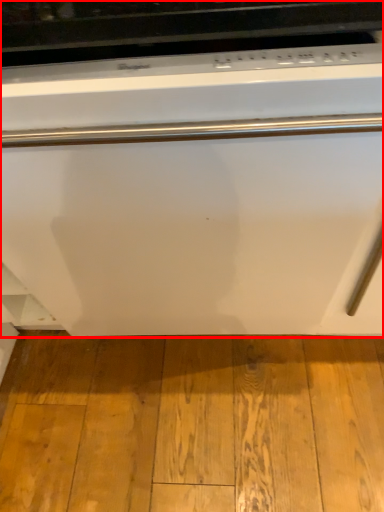
Question: From the image's perspective, what is the correct spatial relationship of home appliance (annotated by the red box) in relation to hardwood?

Choices:
 (A) above
 (B) below

Answer: (A)